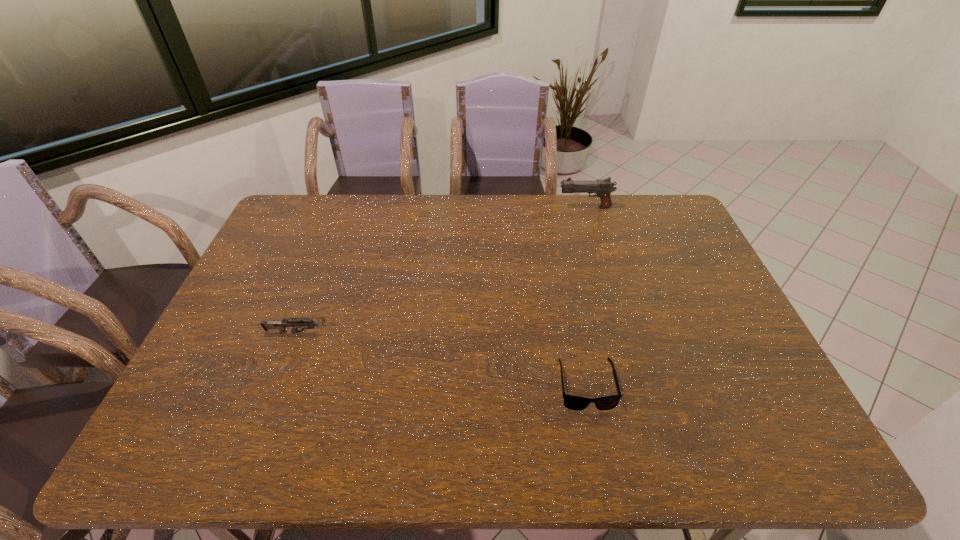
Where is `the taller gun`? the taller gun is located at coordinates (603, 188).

Image resolution: width=960 pixels, height=540 pixels. What are the coordinates of `the right gun` in the screenshot? It's located at (603, 188).

Where is `the shorter gun`? the shorter gun is located at coordinates (279, 325).

The width and height of the screenshot is (960, 540). What are the coordinates of `the second nearest object` in the screenshot? It's located at (279, 325).

I want to click on sunglasses, so click(x=577, y=403).

I want to click on the shortest object, so click(x=577, y=403).

Locate an element on the screen. This screenshot has width=960, height=540. vacant space situated in the direction the farther gun is aimed is located at coordinates (504, 207).

The height and width of the screenshot is (540, 960). I want to click on blank space located 0.280m in the direction the farther gun is aimed, so click(x=483, y=207).

The width and height of the screenshot is (960, 540). Find the location of `free region located 0.300m in the direction the farther gun is aimed`. free region located 0.300m in the direction the farther gun is aimed is located at coordinates (477, 207).

Find the location of a particular element. vacant region located 0.390m aimed along the barrel of the nearer gun is located at coordinates (480, 333).